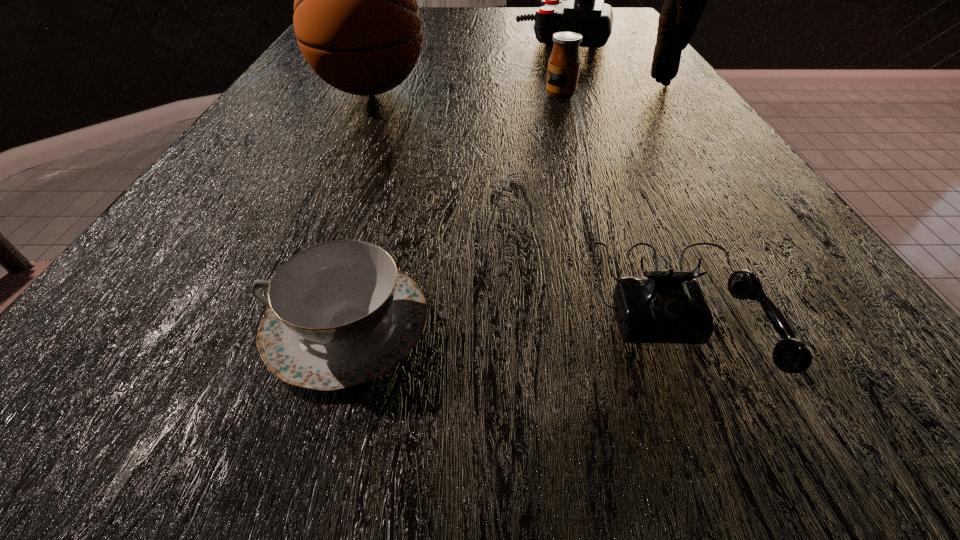
Where is `free spot between the joystick and the rightmost object`? free spot between the joystick and the rightmost object is located at coordinates (612, 62).

Find the location of a particular element. unoccupied position between the rightmost object and the chinaware is located at coordinates click(505, 204).

The width and height of the screenshot is (960, 540). I want to click on empty space between the chinaware and the telephone, so click(x=515, y=314).

You are a GUI agent. You are given a task and a screenshot of the screen. Output one action in this format:
    pyautogui.click(x=<x>, y=<y>)
    Task: Click on the unoccupied position between the telephone and the rightmost object
    The width and height of the screenshot is (960, 540).
    Given the screenshot: What is the action you would take?
    pyautogui.click(x=672, y=194)

Find the location of `blank region between the chinaware and the basketball`. blank region between the chinaware and the basketball is located at coordinates (359, 208).

You are a GUI agent. You are given a task and a screenshot of the screen. Output one action in this format:
    pyautogui.click(x=<x>, y=<y>)
    Task: Click on the vacant region between the telephone and the tallest object
    
    Given the screenshot: What is the action you would take?
    pyautogui.click(x=672, y=194)

The width and height of the screenshot is (960, 540). What are the coordinates of `object that is the fourth nearest to the joystick` in the screenshot? It's located at (669, 306).

Identify which object is located as the nearest to the basketball. Please provide its 2D coordinates. Your answer should be formatted as a tuple, i.e. [(x, y)], where the tuple contains the x and y coordinates of a point satisfying the conditions above.

[(584, 12)]

Find the location of `vacant space that satisfies the following two spatial constraints: 1. on the front-facing side of the tallest object; 2. on the handle side of the chinaware`. vacant space that satisfies the following two spatial constraints: 1. on the front-facing side of the tallest object; 2. on the handle side of the chinaware is located at coordinates pyautogui.click(x=837, y=325).